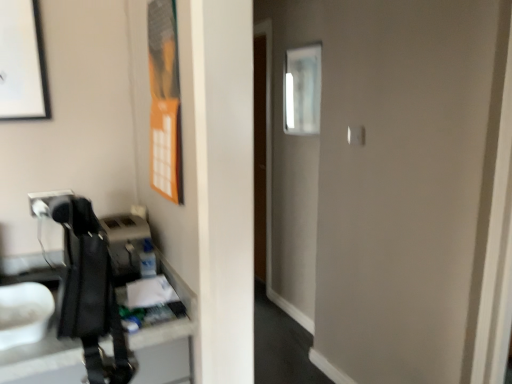
Question: Based on their sizes in the image, would you say clear glass mirror at upper center is bigger or smaller than matte black picture frame at upper left?

Choices:
 (A) big
 (B) small

Answer: (A)

Question: Is clear glass mirror at upper center to the left or to the right of matte black picture frame at upper left in the image?

Choices:
 (A) left
 (B) right

Answer: (B)

Question: Looking at their shapes, would you say clear glass mirror at upper center is wider or thinner than matte black picture frame at upper left?

Choices:
 (A) thin
 (B) wide

Answer: (B)

Question: In the image, is matte black picture frame at upper left positioned in front of or behind clear glass mirror at upper center?

Choices:
 (A) front
 (B) behind

Answer: (A)

Question: From the image's perspective, is matte black picture frame at upper left located above or below clear glass mirror at upper center?

Choices:
 (A) below
 (B) above

Answer: (A)

Question: Based on their positions, is matte black picture frame at upper left located to the left or right of clear glass mirror at upper center?

Choices:
 (A) left
 (B) right

Answer: (A)

Question: In terms of width, does matte black picture frame at upper left look wider or thinner when compared to clear glass mirror at upper center?

Choices:
 (A) thin
 (B) wide

Answer: (A)